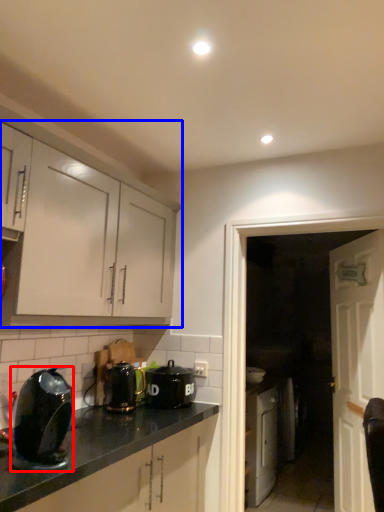
Question: Among these objects, which one is nearest to the camera, kitchen appliance (highlighted by a red box) or cabinetry (highlighted by a blue box)?

Choices:
 (A) kitchen appliance
 (B) cabinetry

Answer: (A)